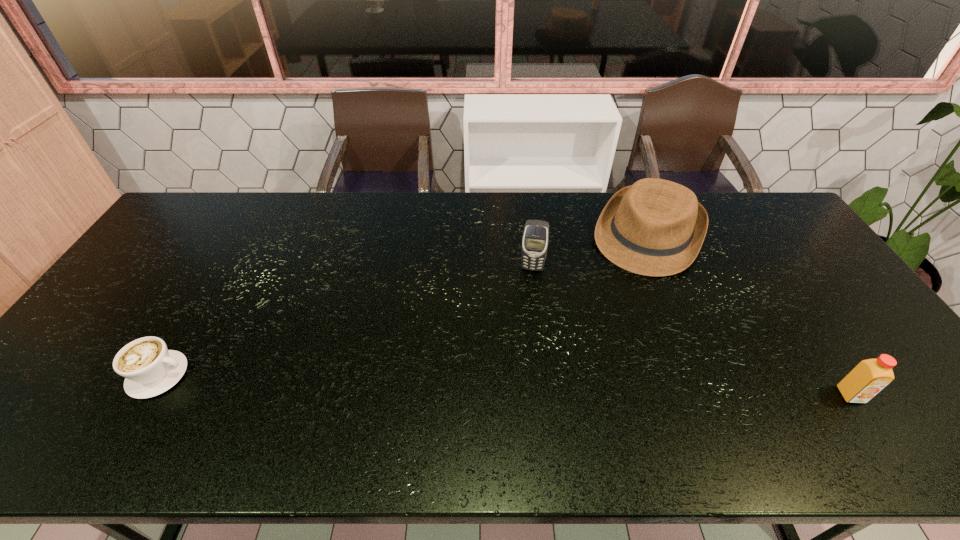
At what (x,y) coordinates should I click in order to perform the action: click on vacant space located 0.220m on the front-facing side of the fedora. Please return your answer as a coordinate pair (x, y). This screenshot has width=960, height=540. Looking at the image, I should click on (608, 320).

Identify the location of free location located on the front-facing side of the fedora. (617, 301).

Where is `vacant region located on the front-facing side of the fedora`? vacant region located on the front-facing side of the fedora is located at coordinates (588, 359).

You are a GUI agent. You are given a task and a screenshot of the screen. Output one action in this format:
    pyautogui.click(x=<x>, y=<y>)
    Task: Click on the object at the far edge
    Image resolution: width=960 pixels, height=540 pixels.
    Given the screenshot: What is the action you would take?
    pyautogui.click(x=655, y=227)

At what (x,y) coordinates should I click in order to perform the action: click on cappuccino that is at the near edge. Please return your answer as a coordinate pair (x, y). Looking at the image, I should click on (149, 368).

The height and width of the screenshot is (540, 960). Identify the location of orange juice that is at the near edge. (870, 376).

Where is `object located at the right edge`? The width and height of the screenshot is (960, 540). object located at the right edge is located at coordinates (870, 376).

Locate an element on the screen. object at the near right corner is located at coordinates (870, 376).

In the image, there is a desktop. Identify the location of free region at the far edge. (377, 198).

Locate an element on the screen. The image size is (960, 540). free space at the near edge is located at coordinates (429, 399).